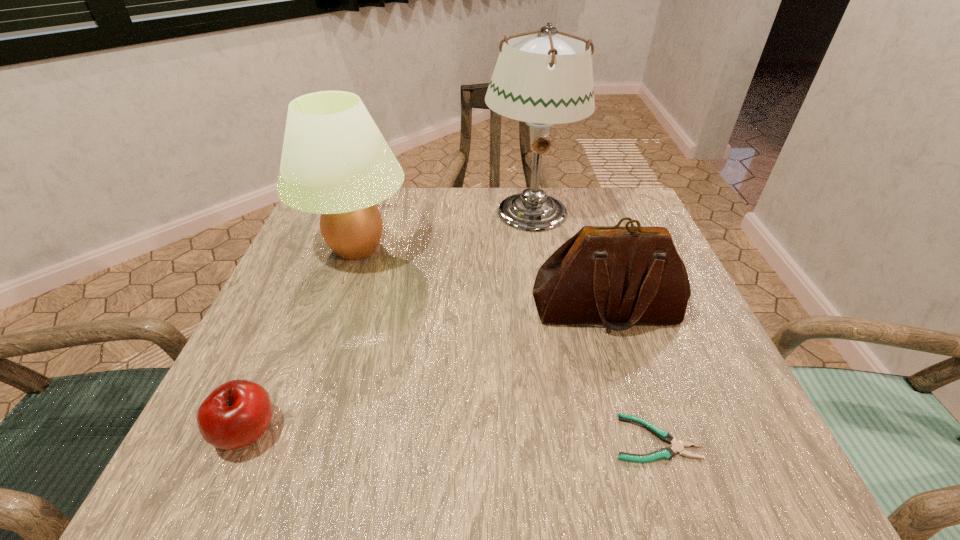
Find the location of a particular element. The image size is (960, 540). the right lampshade is located at coordinates (542, 78).

Where is `the tallest object`? This screenshot has height=540, width=960. the tallest object is located at coordinates (542, 78).

The width and height of the screenshot is (960, 540). Identify the location of the fourth shortest object. (335, 162).

Find the location of a particular element. the left lampshade is located at coordinates (335, 162).

Image resolution: width=960 pixels, height=540 pixels. I want to click on the third tallest object, so click(621, 276).

This screenshot has width=960, height=540. Identify the location of apple. (235, 414).

Image resolution: width=960 pixels, height=540 pixels. In order to click on the shortest object in this screenshot , I will do `click(667, 453)`.

At what (x,y) coordinates should I click in order to perform the action: click on vacant space situated on the lampshade of the right lampshade. Please return your answer as a coordinate pair (x, y). The width and height of the screenshot is (960, 540). Looking at the image, I should click on (540, 270).

Locate an element on the screen. The height and width of the screenshot is (540, 960). free space located on the shade of the second tallest object is located at coordinates (316, 368).

I want to click on vacant space located on the back of the third shortest object, so click(592, 263).